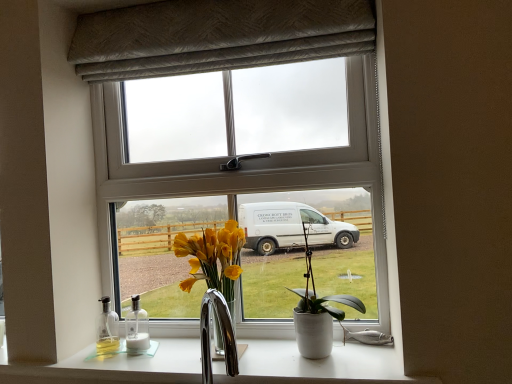
Where is `vacant area that is in front of white ceramic pot at center`? This screenshot has width=512, height=384. vacant area that is in front of white ceramic pot at center is located at coordinates (324, 372).